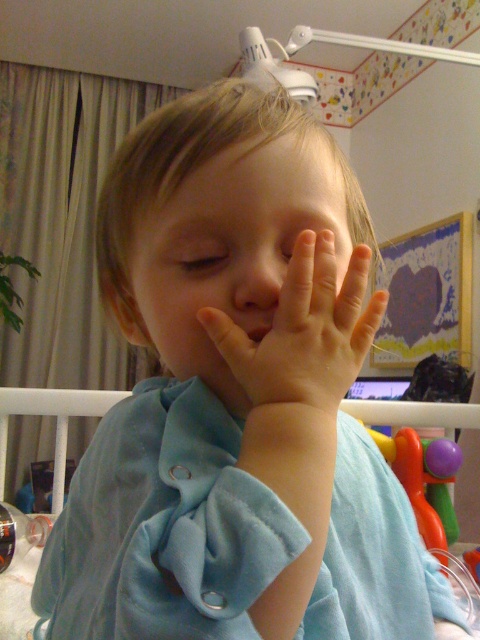
Question: Is smooth flesh hand at center positioned at the back of blue soft fabric infant bed at center?

Choices:
 (A) yes
 (B) no

Answer: (B)

Question: Is smooth flesh hand at center positioned before blue soft fabric infant bed at center?

Choices:
 (A) yes
 (B) no

Answer: (A)

Question: Based on their relative distances, which object is farther from the blue soft fabric infant bed at center?

Choices:
 (A) smooth skin face at center
 (B) smooth flesh hand at center

Answer: (B)

Question: Is smooth flesh hand at center thinner than blue soft fabric infant bed at center?

Choices:
 (A) yes
 (B) no

Answer: (A)

Question: Which of these objects is positioned farthest from the smooth flesh hand at center?

Choices:
 (A) smooth skin face at center
 (B) blue soft fabric infant bed at center

Answer: (B)

Question: Which of the following is the closest to the observer?

Choices:
 (A) (135, 280)
 (B) (10, 404)

Answer: (A)